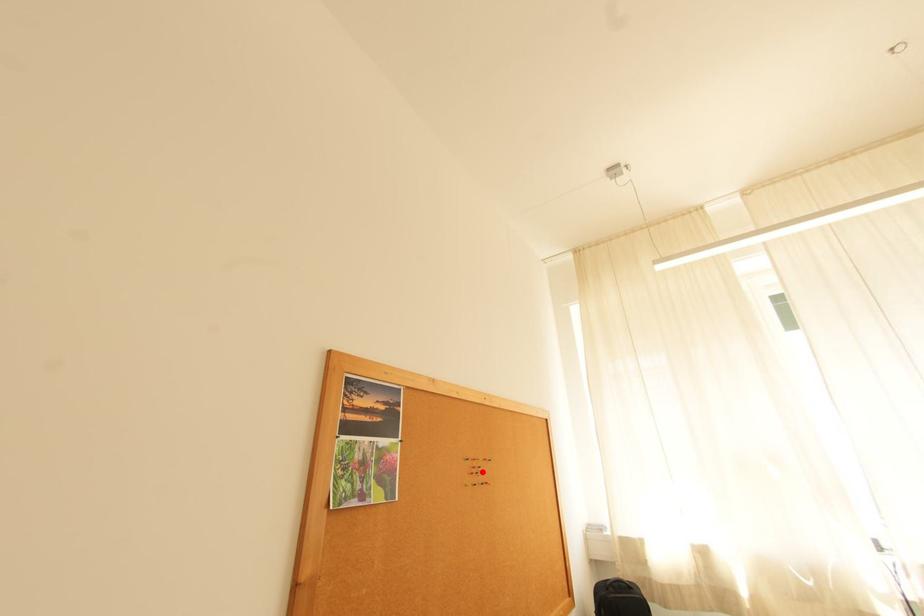
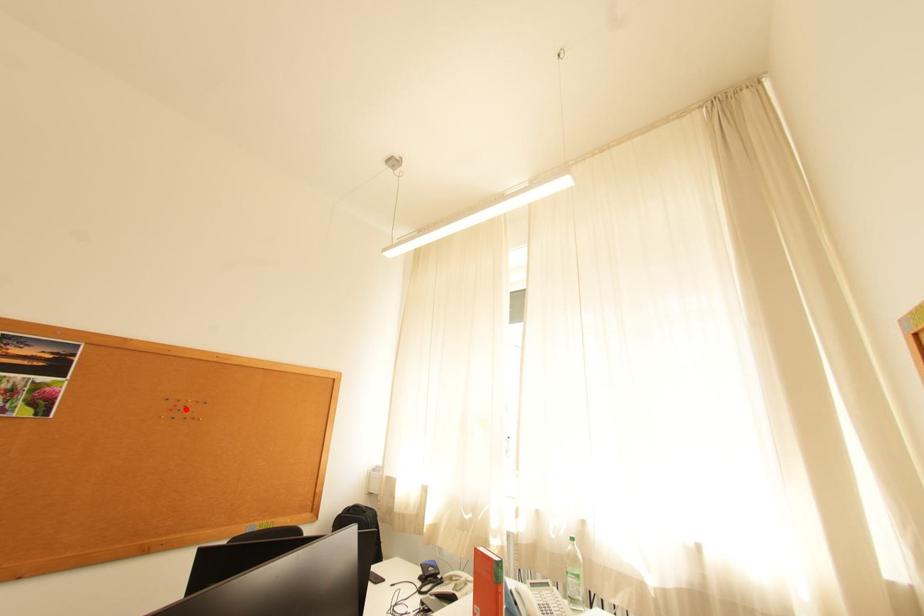
I am providing you with two images of the same scene from different viewpoints. A red point is marked on the first image and another point is marked on the second image. Are the points marked in image1 and image2 representing the same 3D position?

Yes